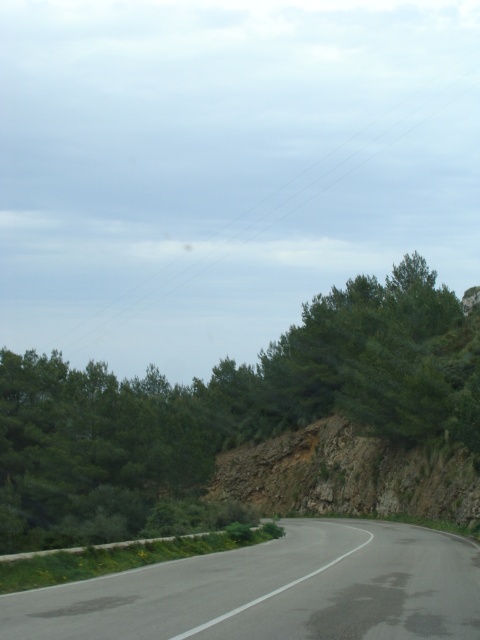
Which is more to the right, green leafy tree at center or black asphalt road at center?

black asphalt road at center is more to the right.

Describe the element at coordinates (228, 408) in the screenshot. I see `green leafy tree at center` at that location.

The width and height of the screenshot is (480, 640). Describe the element at coordinates (228, 408) in the screenshot. I see `green leafy tree at center` at that location.

The height and width of the screenshot is (640, 480). What are the coordinates of `green leafy tree at center` in the screenshot? It's located at (228, 408).